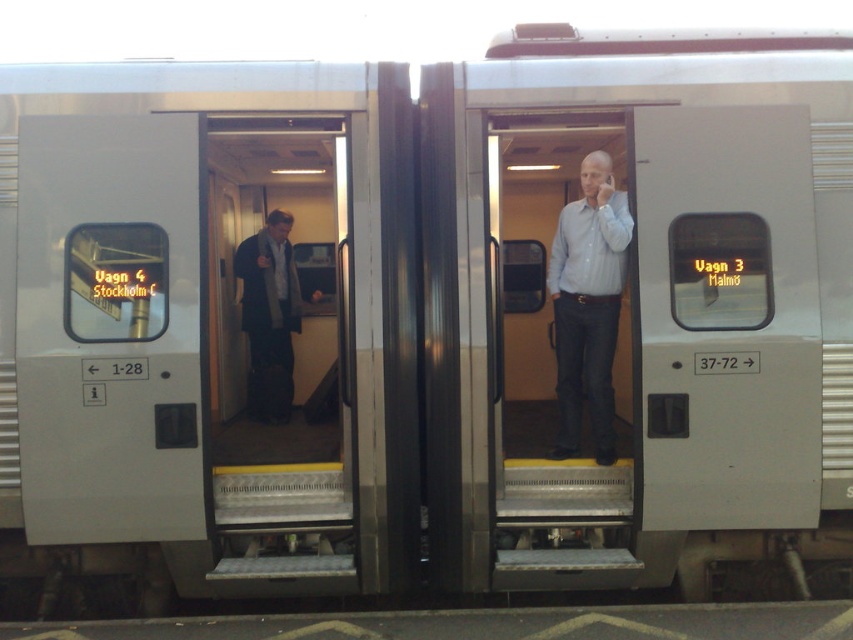
Can you confirm if metallic gray door at center is bigger than dark gray suit at left?

Yes.

Can you confirm if metallic gray door at center is smaller than dark gray suit at left?

No, metallic gray door at center is not smaller than dark gray suit at left.

Locate an element on the screen. metallic gray door at center is located at coordinates (277, 358).

Does metallic gray door at center come in front of light blue shirt at center?

That is False.

Between metallic gray door at center and light blue shirt at center, which one has less height?

light blue shirt at center

Is point (292, 387) farther from viewer compared to point (566, 225)?

Yes, point (292, 387) is behind point (566, 225).

At what (x,y) coordinates should I click in order to perform the action: click on metallic gray door at center. Please return your answer as a coordinate pair (x, y). This screenshot has width=853, height=640. Looking at the image, I should click on (277, 358).

How much distance is there between light blue shirt at center and dark gray suit at left?

light blue shirt at center and dark gray suit at left are 2.36 meters apart.

The image size is (853, 640). What do you see at coordinates (589, 305) in the screenshot? I see `light blue shirt at center` at bounding box center [589, 305].

Locate an element on the screen. light blue shirt at center is located at coordinates (589, 305).